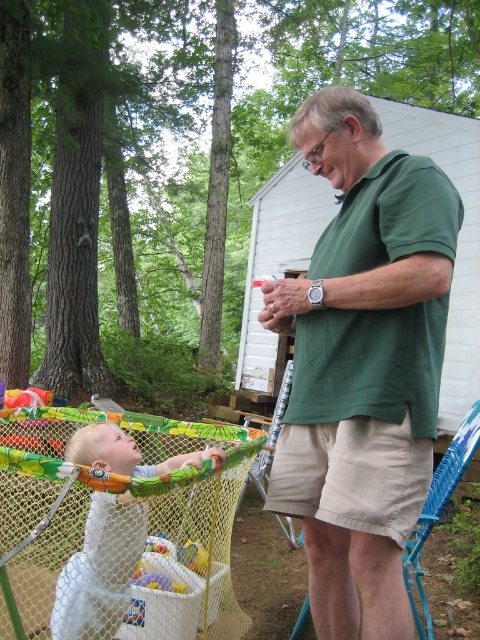
Question: Which object is the closest to the green cotton shirt at center?

Choices:
 (A) plastic yellow ball at center
 (B) white mesh baby at center

Answer: (B)

Question: Is green cotton shirt at center further to camera compared to plastic yellow ball at center?

Choices:
 (A) yes
 (B) no

Answer: (B)

Question: Which point appears farthest from the camera in this image?

Choices:
 (A) (188, 552)
 (B) (384, 308)

Answer: (A)

Question: Which point appears farthest from the camera in this image?

Choices:
 (A) (x=402, y=602)
 (B) (x=59, y=604)
 (C) (x=197, y=568)

Answer: (C)

Question: Can you confirm if green cotton shirt at center is bigger than plastic yellow ball at center?

Choices:
 (A) yes
 (B) no

Answer: (A)

Question: Is green cotton shirt at center positioned at the back of white mesh baby at center?

Choices:
 (A) no
 (B) yes

Answer: (A)